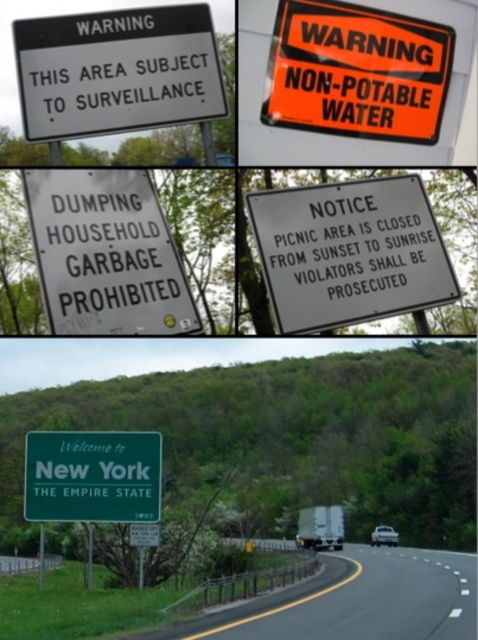
Is green asphalt road at lower center in front of white paper notice at center?

No, it is behind white paper notice at center.

Is point (303, 630) positioned before point (315, 221)?

No, it is not.

Is point (19, 579) closer to viewer compared to point (370, 227)?

No, (19, 579) is further to viewer.

Where is `green asphalt road at lower center`? The image size is (478, 640). green asphalt road at lower center is located at coordinates (361, 600).

Is point (327, 202) closer to viewer compared to point (148, 499)?

That is True.

Does white paper notice at center lie in front of green matte signboard at center?

Yes, white paper notice at center is in front of green matte signboard at center.

Does point (313, 307) lie in front of point (29, 497)?

That is True.

Locate an element on the screen. Image resolution: width=478 pixels, height=640 pixels. white paper notice at center is located at coordinates (349, 252).

Can you confirm if green asphalt road at lower center is positioned above white plastic sign at upper left?

Incorrect, green asphalt road at lower center is not positioned above white plastic sign at upper left.

Is point (452, 600) closer to viewer compared to point (184, 20)?

No, (452, 600) is behind (184, 20).

Which is in front, point (189, 630) or point (96, 20)?

Point (96, 20) is more forward.

Where is `green asphalt road at lower center`? The width and height of the screenshot is (478, 640). green asphalt road at lower center is located at coordinates (361, 600).